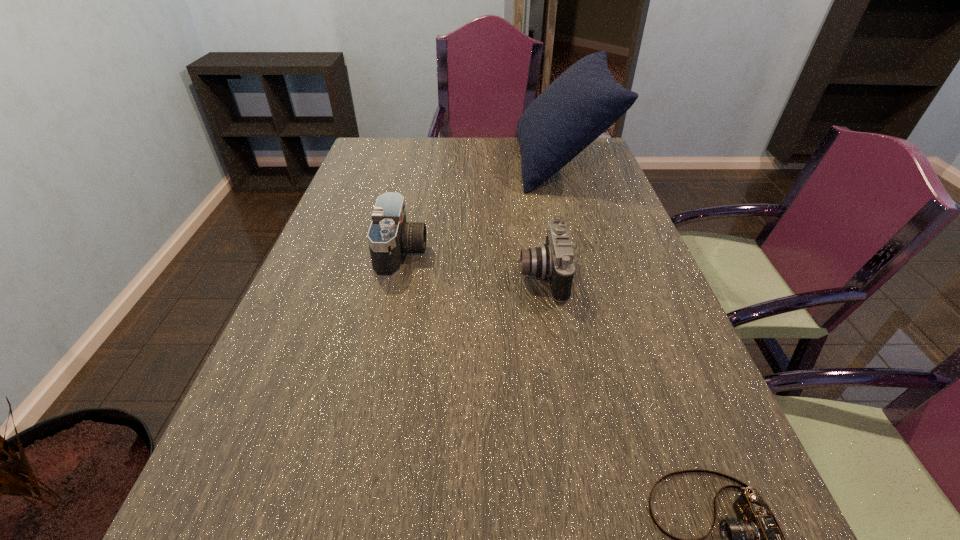
Select which object appears as the closest to the nearest camera. Please provide its 2D coordinates. Your answer should be formatted as a tuple, i.e. [(x, y)], where the tuple contains the x and y coordinates of a point satisfying the conditions above.

[(554, 260)]

Select which object appears as the third closest to the cushion. Please provide its 2D coordinates. Your answer should be formatted as a tuple, i.e. [(x, y)], where the tuple contains the x and y coordinates of a point satisfying the conditions above.

[(755, 539)]

At what (x,y) coordinates should I click in order to perform the action: click on camera identified as the closest to the second camera from left to right. Please return your answer as a coordinate pair (x, y). The width and height of the screenshot is (960, 540). Looking at the image, I should click on (390, 236).

Where is `camera that is the closest to the second camera from right to left`? The height and width of the screenshot is (540, 960). camera that is the closest to the second camera from right to left is located at coordinates (390, 236).